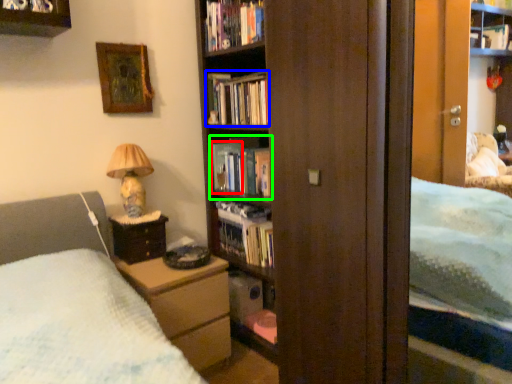
Question: Considering the real-world distances, which object is farthest from paperback book (highlighted by a red box)? book (highlighted by a blue box) or book (highlighted by a green box)?

Choices:
 (A) book
 (B) book

Answer: (A)